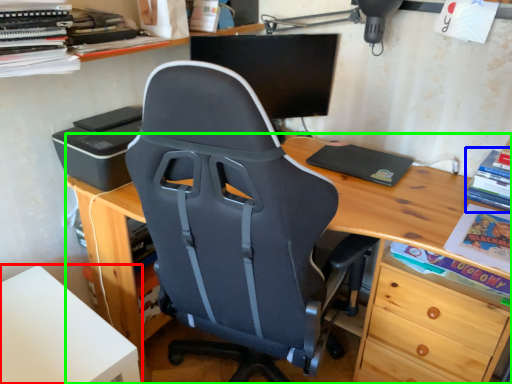
Question: Based on their relative distances, which object is nearer to table (highlighted by a red box)? Choose from book (highlighted by a blue box) and desk (highlighted by a green box).

Choices:
 (A) book
 (B) desk

Answer: (B)